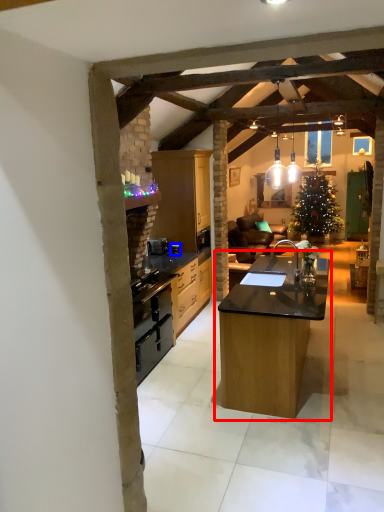
Question: Among these objects, which one is farthest to the camera, table (highlighted by a red box) or appliance (highlighted by a blue box)?

Choices:
 (A) table
 (B) appliance

Answer: (B)